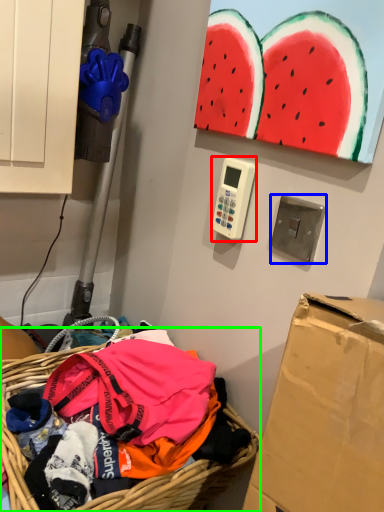
Question: Which object is positioned closest to scale (highlighted by a red box)? Select from light switch (highlighted by a blue box) and basket (highlighted by a green box).

Choices:
 (A) light switch
 (B) basket

Answer: (B)